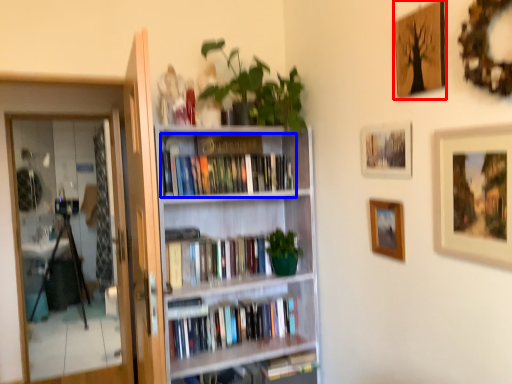
Question: Among these objects, which one is farthest to the camera, picture frame (highlighted by a red box) or book (highlighted by a blue box)?

Choices:
 (A) picture frame
 (B) book

Answer: (B)